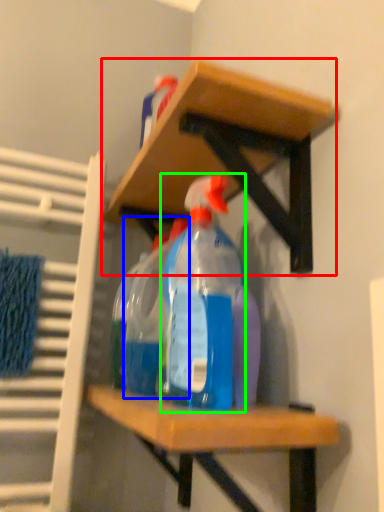
Question: Which is nearer to the shelf (highlighted by a red box)? bottle (highlighted by a blue box) or bottle (highlighted by a green box).

Choices:
 (A) bottle
 (B) bottle

Answer: (B)